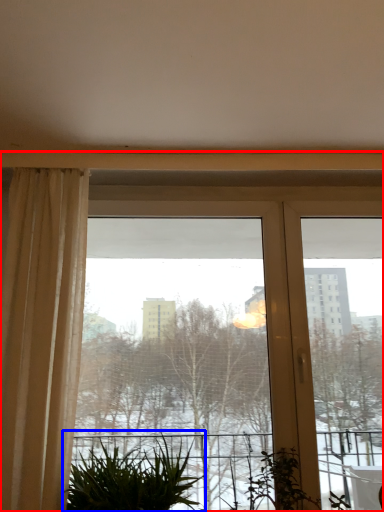
Question: Which point is closer to the camera, window (highlighted by a red box) or houseplant (highlighted by a blue box)?

Choices:
 (A) window
 (B) houseplant

Answer: (B)